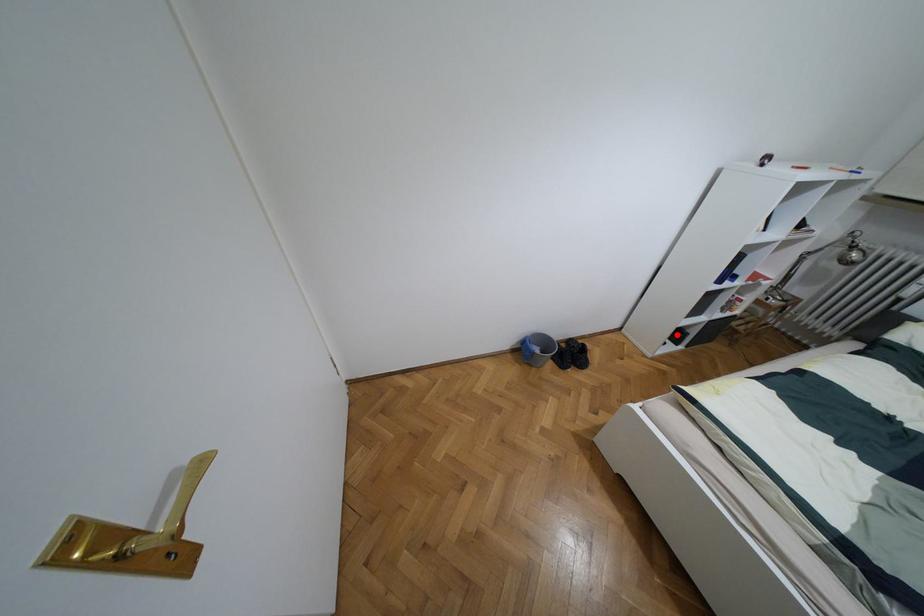
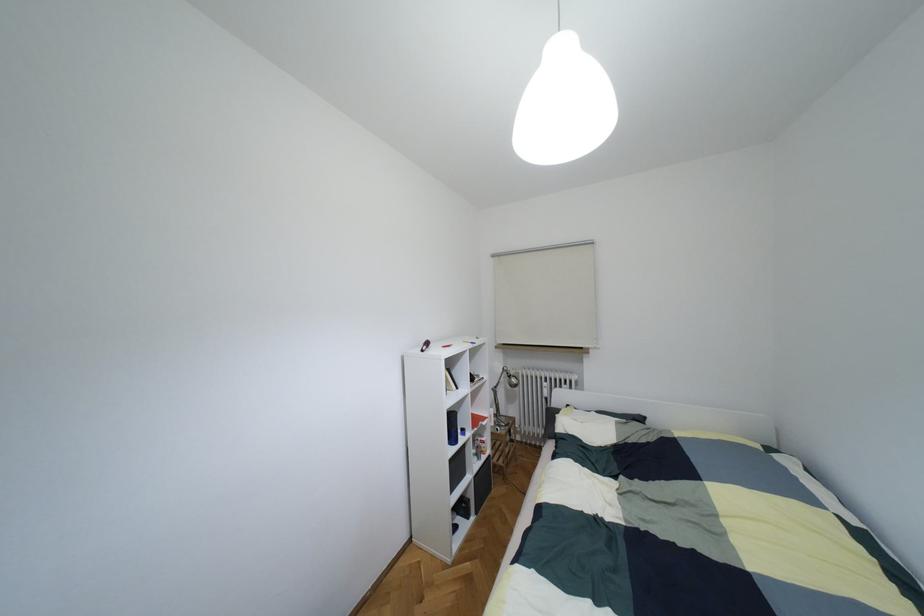
The point at the highlighted location is marked in the first image. Where is the corresponding point in the second image?

(460, 508)